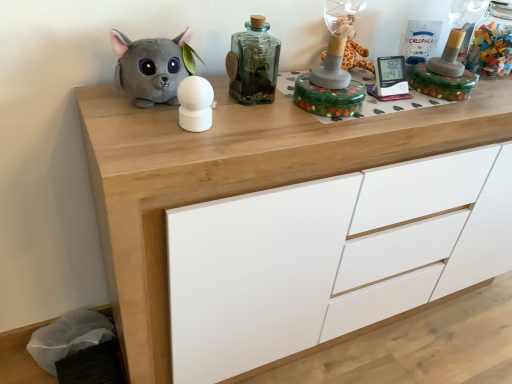
Identify the location of spots to the right of green floral box at center, acting as the 1th toy starting from the right. Image resolution: width=512 pixels, height=384 pixels. (401, 112).